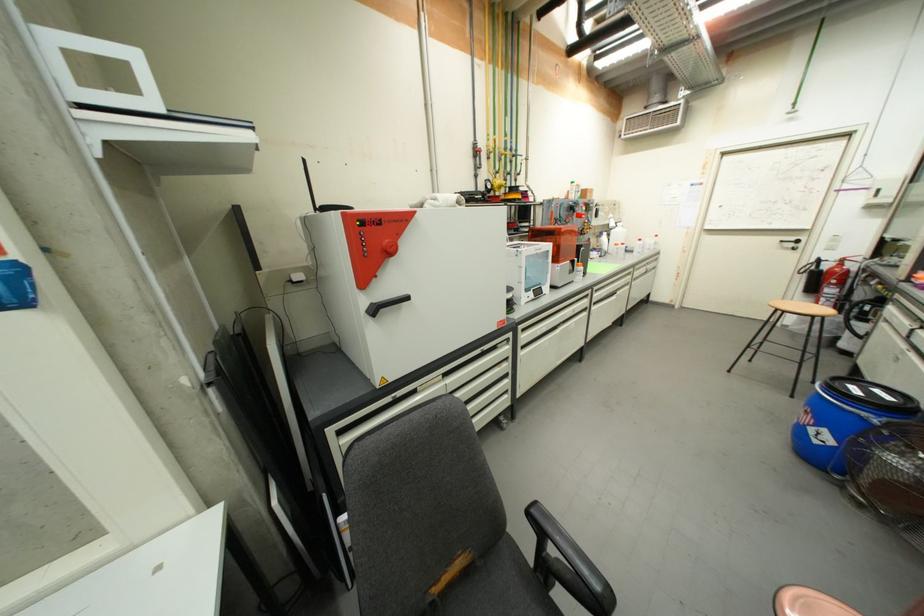
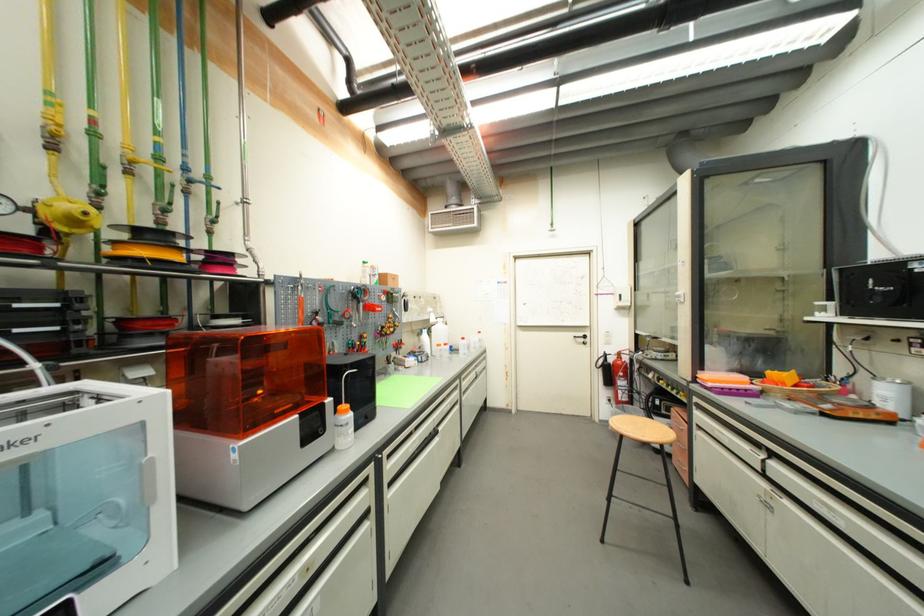
The point at (839, 300) is marked in the first image. Where is the corresponding point in the second image?

(630, 391)